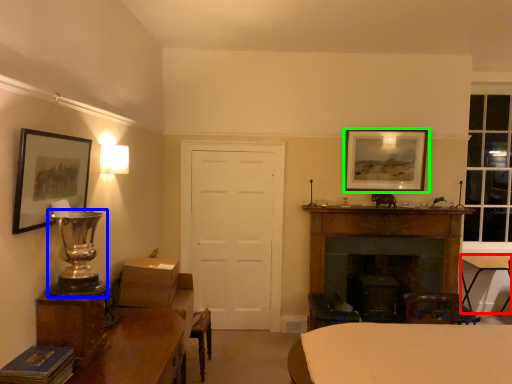
Question: Which object is positioned farthest from table (highlighted by a red box)? Select from table lamp (highlighted by a blue box) and picture frame (highlighted by a green box).

Choices:
 (A) table lamp
 (B) picture frame

Answer: (A)